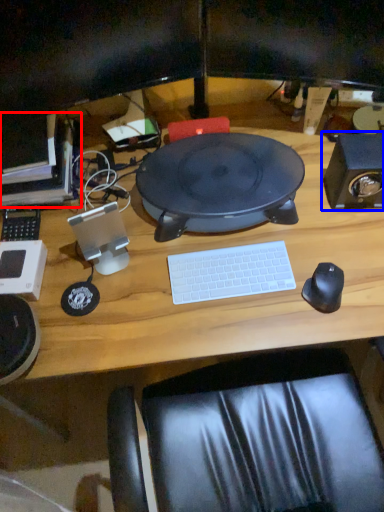
Question: Which object appears farthest to the camera in this image, computer (highlighted by a red box) or speaker (highlighted by a blue box)?

Choices:
 (A) computer
 (B) speaker

Answer: (A)